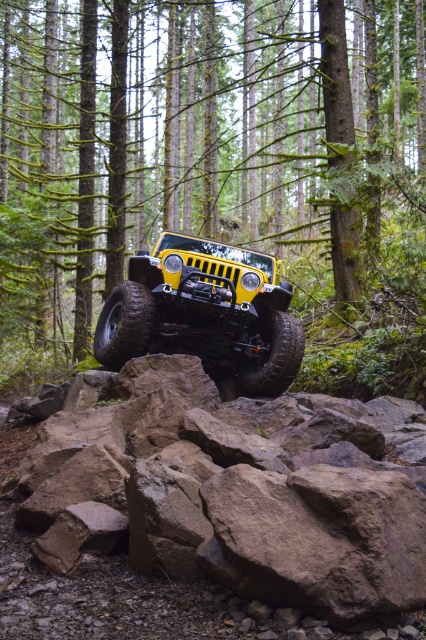
Question: Can you confirm if brown rough rock at center is positioned below yellow matte/soft jeep at center?

Choices:
 (A) no
 (B) yes

Answer: (B)

Question: Does green mossy tree trunk at center have a greater width compared to yellow matte/soft jeep at center?

Choices:
 (A) no
 (B) yes

Answer: (B)

Question: Which point is farther to the camera?

Choices:
 (A) green mossy tree trunk at center
 (B) brown rough rock at center
 (C) yellow matte/soft jeep at center

Answer: (A)

Question: Which of these objects is positioned farthest from the green mossy tree trunk at center?

Choices:
 (A) brown rough rock at center
 (B) yellow matte/soft jeep at center

Answer: (A)

Question: Is green mossy tree trunk at center smaller than brown rough rock at center?

Choices:
 (A) yes
 (B) no

Answer: (B)

Question: Which point is farther to the camera?

Choices:
 (A) yellow matte/soft jeep at center
 (B) green mossy tree trunk at center
 (C) brown rough rock at center

Answer: (B)